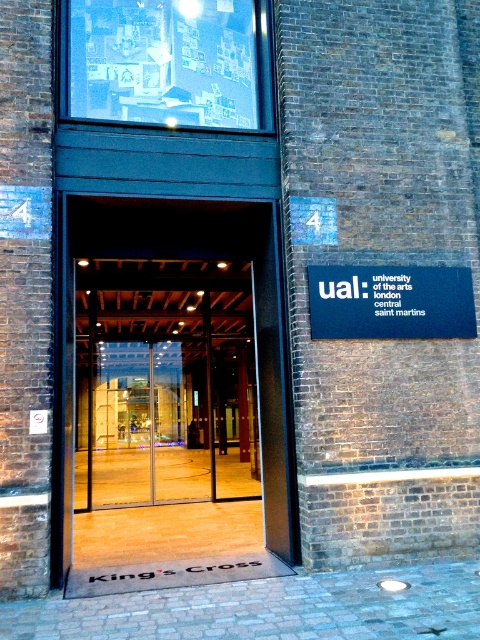
Question: Which of the following is the farthest from the observer?

Choices:
 (A) blue matte sign at center
 (B) transparent glass door at center

Answer: (A)

Question: Can you confirm if transparent glass door at center is wider than blue matte sign at center?

Choices:
 (A) no
 (B) yes

Answer: (B)

Question: Which of the following is the closest to the observer?

Choices:
 (A) blue matte sign at center
 (B) transparent glass door at center

Answer: (B)

Question: Is transparent glass door at center thinner than blue matte sign at center?

Choices:
 (A) no
 (B) yes

Answer: (A)

Question: Can you confirm if transparent glass door at center is positioned above blue matte sign at center?

Choices:
 (A) yes
 (B) no

Answer: (B)